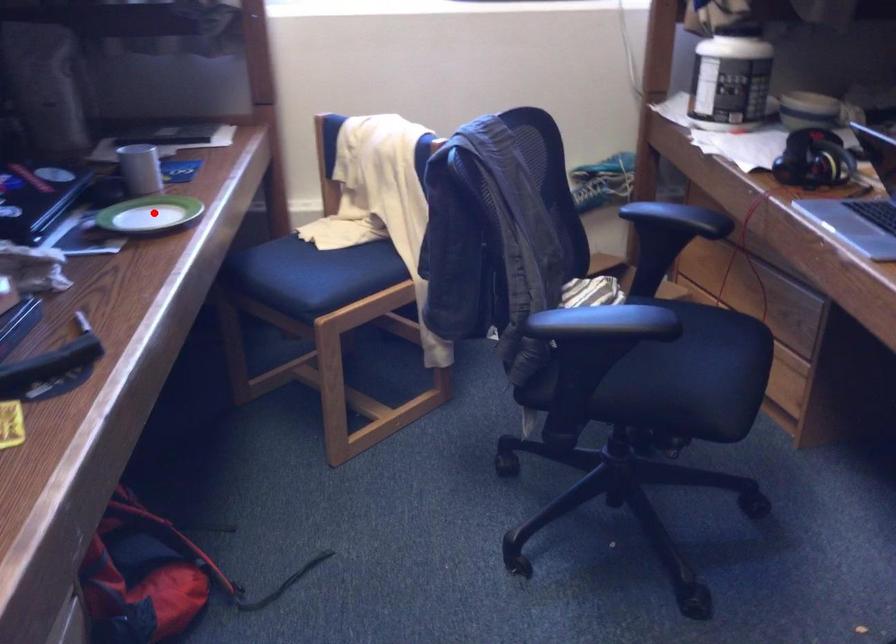
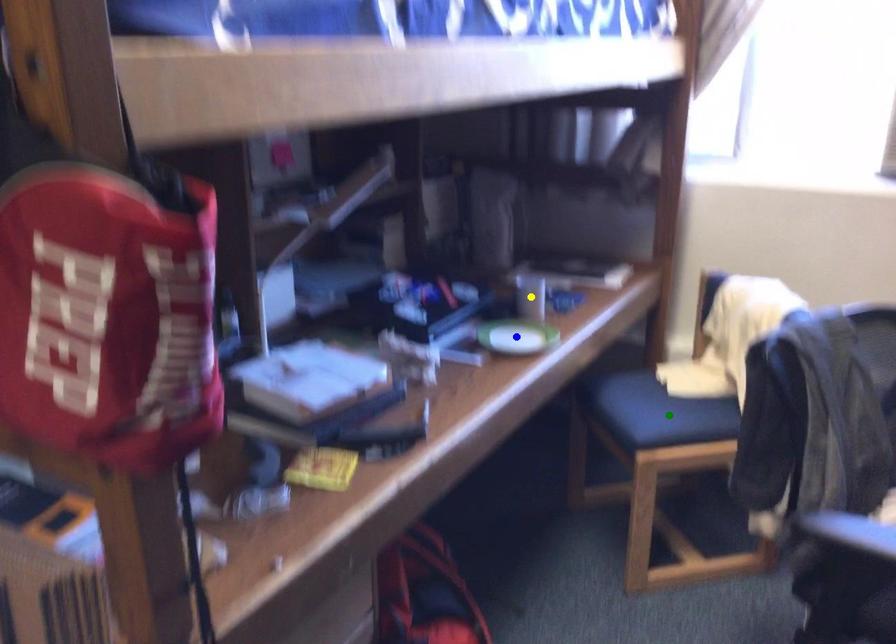
Question: I am providing you with two images of the same scene from different viewpoints. A red point is marked on the first image. You are given multiple points on the second image. Which point in image 2 is actually the same real-world point as the red point in image 1?

Choices:
 (A) yellow point
 (B) green point
 (C) blue point

Answer: (C)